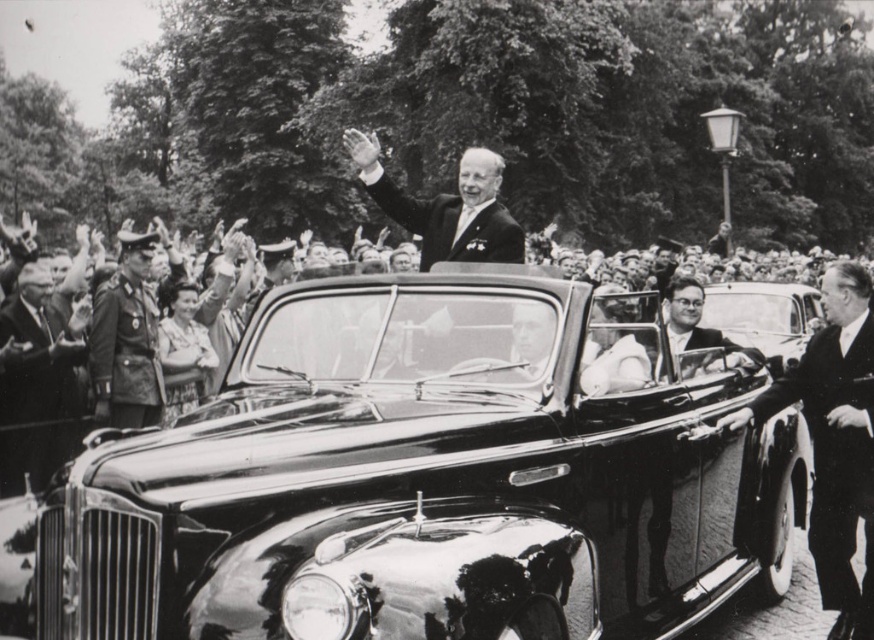
Question: In this image, where is shiny black car at center located relative to dark brown leather uniform at left?

Choices:
 (A) left
 (B) right

Answer: (B)

Question: Can you confirm if smooth black suit at right is positioned to the left of dark brown leather uniform at left?

Choices:
 (A) yes
 (B) no

Answer: (B)

Question: Does shiny black car at center have a lesser width compared to smooth black suit at right?

Choices:
 (A) no
 (B) yes

Answer: (A)

Question: Which object is farther from the camera taking this photo?

Choices:
 (A) smooth black suit at right
 (B) dark brown leather uniform at left

Answer: (B)

Question: Based on their relative distances, which object is farther from the shiny black car at center?

Choices:
 (A) dark brown leather uniform at left
 (B) smooth black suit at right

Answer: (A)

Question: Which point appears farthest from the camera in this image?

Choices:
 (A) (841, 285)
 (B) (128, 284)

Answer: (B)